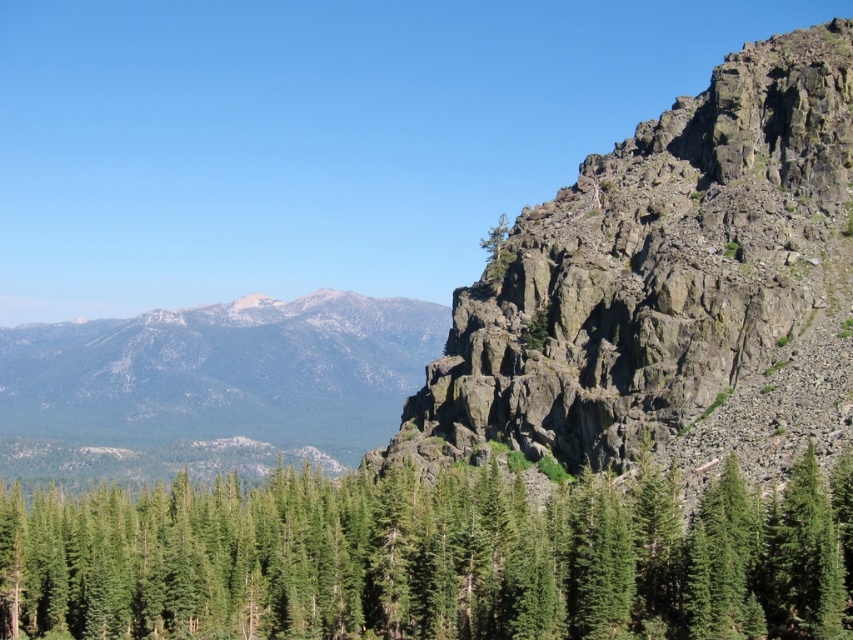
Question: Does green matte tree at center come behind rugged stone mountain at right?

Choices:
 (A) no
 (B) yes

Answer: (A)

Question: Among these points, which one is nearest to the camera?

Choices:
 (A) (518, 496)
 (B) (705, 129)

Answer: (A)

Question: Does green matte tree at center have a smaller size compared to rugged stone mountain at right?

Choices:
 (A) no
 (B) yes

Answer: (B)

Question: Which point is farther to the camera?

Choices:
 (A) (480, 497)
 (B) (515, 368)

Answer: (B)

Question: Observing the image, what is the correct spatial positioning of green matte tree at center in reference to rugged stone mountain at right?

Choices:
 (A) below
 (B) above

Answer: (A)